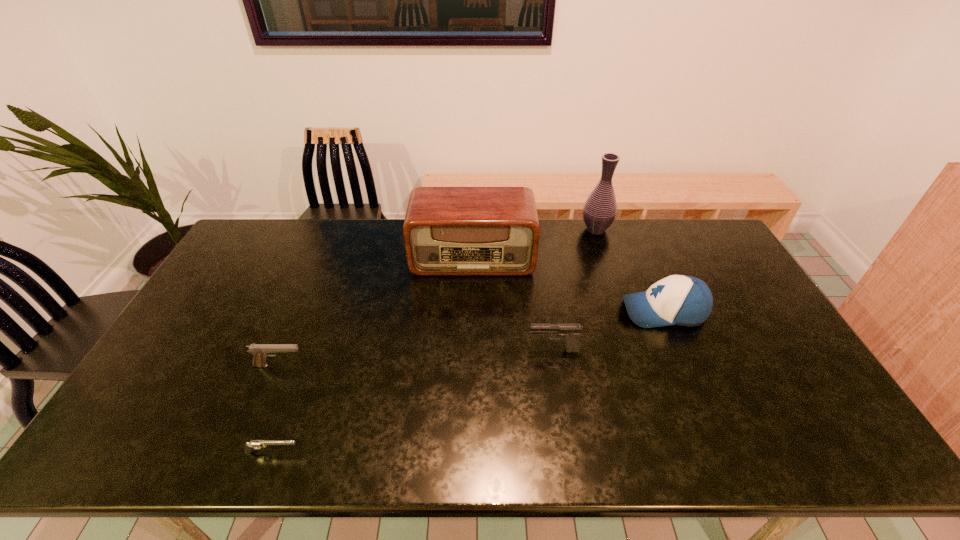
The width and height of the screenshot is (960, 540). Find the location of `the tallest object`. the tallest object is located at coordinates (600, 209).

Where is `the farthest object`? The height and width of the screenshot is (540, 960). the farthest object is located at coordinates (600, 209).

Find the location of `radio receiver`. radio receiver is located at coordinates (447, 230).

The width and height of the screenshot is (960, 540). Find the location of `the second tallest object`. the second tallest object is located at coordinates (447, 230).

Where is `the third tallest object`? The image size is (960, 540). the third tallest object is located at coordinates (682, 300).

Identify the location of the third farthest object. The width and height of the screenshot is (960, 540). [682, 300].

The width and height of the screenshot is (960, 540). What are the coordinates of `the farthest pistol` in the screenshot? It's located at (570, 332).

Locate an element on the screen. This screenshot has height=540, width=960. the third shortest object is located at coordinates (570, 332).

Image resolution: width=960 pixels, height=540 pixels. Find the location of `the second shortest object`. the second shortest object is located at coordinates 259,351.

I want to click on the second shortest pistol, so click(259, 351).